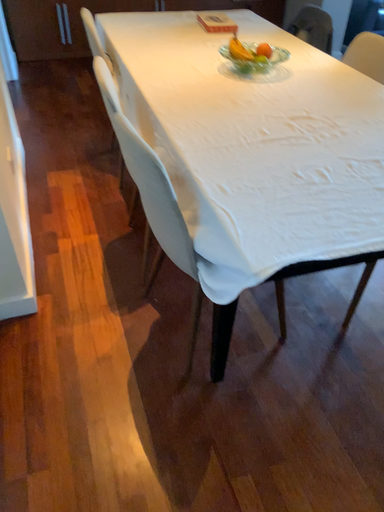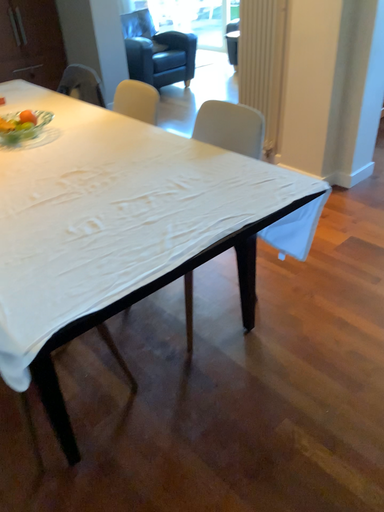
Question: How did the camera likely rotate when shooting the video?

Choices:
 (A) rotated right
 (B) rotated left

Answer: (A)